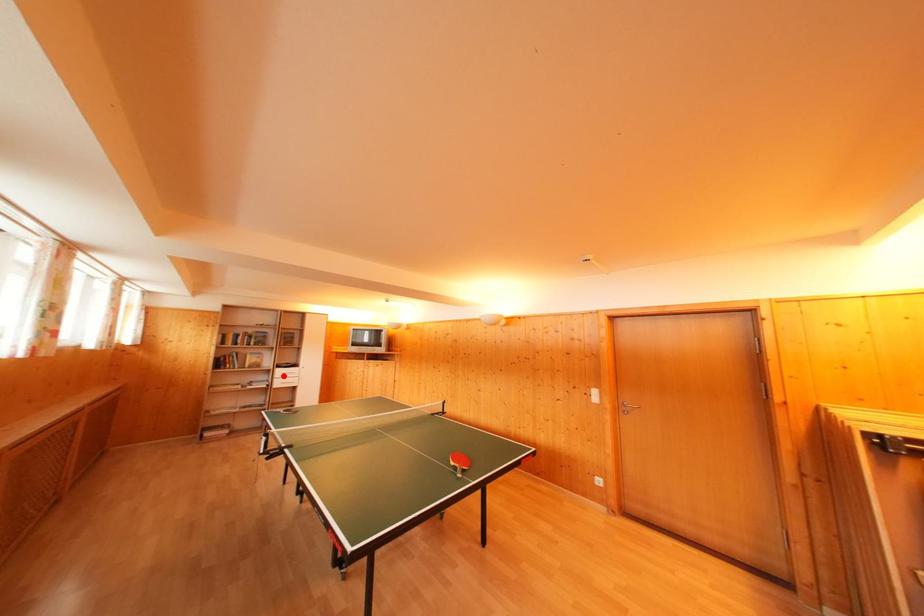
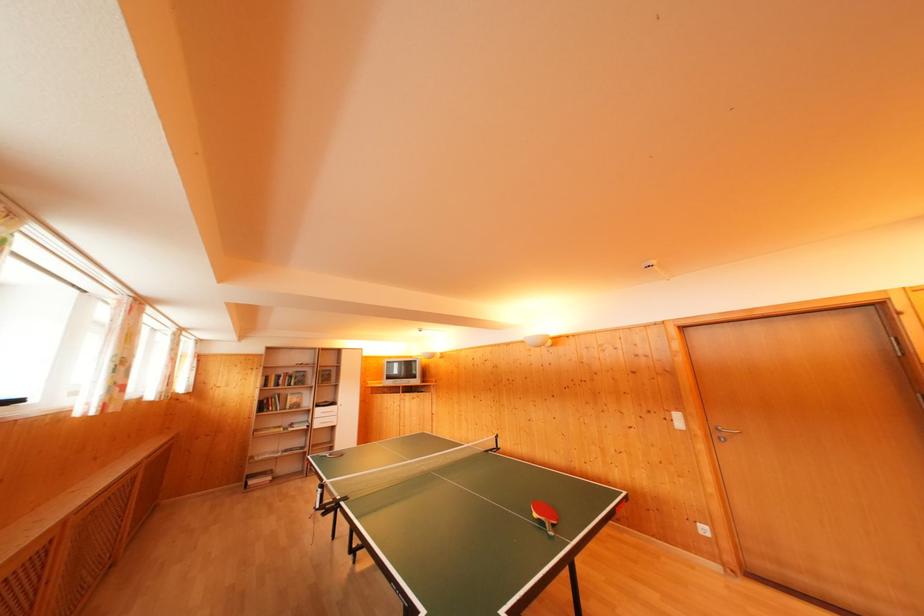
The point at the highlighted location is marked in the first image. Where is the corresponding point in the second image?

(322, 416)